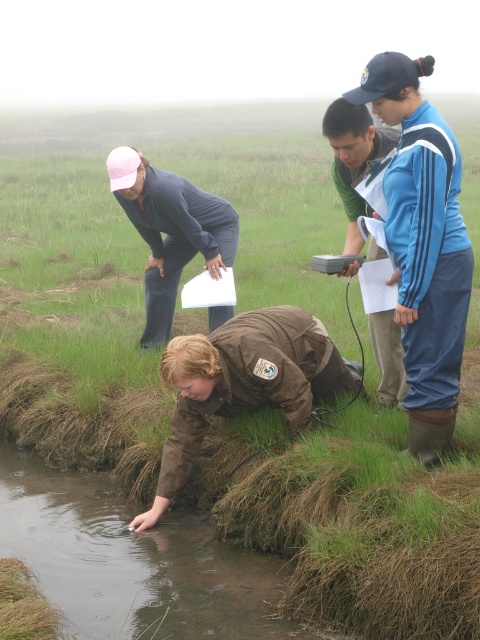
You are a researcher standing at the camera position. You need to retrieve the matte pink cap at upper left for a critical experiment. Can you reach it without moving from your current position?

The matte pink cap at upper left is 5.31 meters away from camera, so you cannot reach it without moving from your current position.

You are a researcher in the field and need to locate your equipment. You see the brown suede jacket at lower center and the matte pink cap at upper left. Which object is positioned to the right side of the other?

The brown suede jacket at lower center is to the right of matte pink cap at upper left.